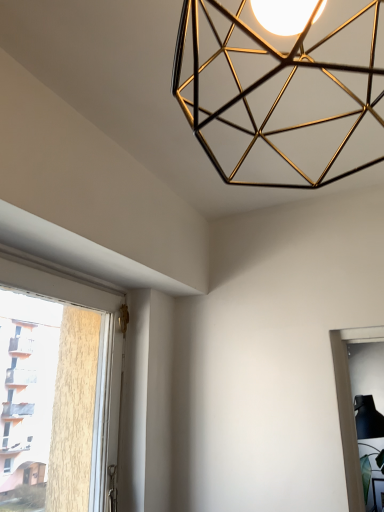
The image size is (384, 512). Identify the location of transparent glass window at lower right, which is the 2th window from front to back. (349, 408).

Image resolution: width=384 pixels, height=512 pixels. Find the location of `gold metallic geometric light fixture at upper center`. gold metallic geometric light fixture at upper center is located at coordinates (266, 81).

From a real-world perspective, which is physically below, white plastic window at left, the 2th window when ordered from bottom to top, or gold metallic geometric light fixture at upper center?

white plastic window at left, the 2th window when ordered from bottom to top.

Consider the image. Is white plastic window at left, placed as the second window when sorted from back to front, thinner than gold metallic geometric light fixture at upper center?

Yes.

Considering the positions of points (13, 269) and (190, 113), is point (13, 269) closer to camera compared to point (190, 113)?

No, it is behind (190, 113).

From the image's perspective, is white plastic window at left, arranged as the 1th window when viewed from the left, over gold metallic geometric light fixture at upper center?

Actually, white plastic window at left, arranged as the 1th window when viewed from the left, appears below gold metallic geometric light fixture at upper center in the image.

Who is smaller, gold metallic geometric light fixture at upper center or transparent glass window at lower right, arranged as the first window when viewed from the back?

gold metallic geometric light fixture at upper center.

Is gold metallic geometric light fixture at upper center to the left or to the right of transparent glass window at lower right, which is counted as the 2th window, starting from the top, in the image?

gold metallic geometric light fixture at upper center is positioned on transparent glass window at lower right, which is counted as the 2th window, starting from the top,'s left side.

Considering the sizes of gold metallic geometric light fixture at upper center and transparent glass window at lower right, which is the 2th window from front to back, in the image, is gold metallic geometric light fixture at upper center wider or thinner than transparent glass window at lower right, which is the 2th window from front to back,?

Clearly, gold metallic geometric light fixture at upper center has less width compared to transparent glass window at lower right, which is the 2th window from front to back.

The height and width of the screenshot is (512, 384). What are the coordinates of `lamp in front of the transparent glass window at lower right, which is the 1th window in right-to-left order` in the screenshot? It's located at (266, 81).

Can you tell me how much transparent glass window at lower right, which is counted as the 2th window, starting from the top, and white plastic window at left, arranged as the 1th window when viewed from the left, differ in facing direction?

The angle between the facing direction of transparent glass window at lower right, which is counted as the 2th window, starting from the top, and the facing direction of white plastic window at left, arranged as the 1th window when viewed from the left, is 39.8 degrees.

Is transparent glass window at lower right, which is the second window in left-to-right order, smaller than white plastic window at left, placed as the second window when sorted from back to front?

No.

Is transparent glass window at lower right, which is the 2th window from front to back, to the right of white plastic window at left, the 2th window when ordered from bottom to top, from the viewer's perspective?

Yes.

Which is more to the right, white plastic window at left, arranged as the 1th window when viewed from the front, or transparent glass window at lower right, which is counted as the 2th window, starting from the top?

transparent glass window at lower right, which is counted as the 2th window, starting from the top.

Is white plastic window at left, placed as the second window when sorted from back to front, in contact with transparent glass window at lower right, which is counted as the 2th window, starting from the top?

No, white plastic window at left, placed as the second window when sorted from back to front, is not in contact with transparent glass window at lower right, which is counted as the 2th window, starting from the top.

You are a GUI agent. You are given a task and a screenshot of the screen. Output one action in this format:
    pyautogui.click(x=<x>, y=<y>)
    Task: Click on the window located above the transparent glass window at lower right, which is counted as the 2th window, starting from the top (from a real-world perspective)
    This screenshot has height=512, width=384.
    Given the screenshot: What is the action you would take?
    pyautogui.click(x=53, y=282)

Does white plastic window at left, the 2th window from the right, lie in front of transparent glass window at lower right, arranged as the first window when viewed from the back?

Yes, white plastic window at left, the 2th window from the right, is closer to the viewer.

You are a GUI agent. You are given a task and a screenshot of the screen. Output one action in this format:
    pyautogui.click(x=<x>, y=<y>)
    Task: Click on the lamp in front of the white plastic window at left, the 2th window from the right
    The image size is (384, 512).
    Given the screenshot: What is the action you would take?
    pyautogui.click(x=266, y=81)

Who is taller, gold metallic geometric light fixture at upper center or white plastic window at left, placed as the second window when sorted from back to front?

Standing taller between the two is white plastic window at left, placed as the second window when sorted from back to front.

Does gold metallic geometric light fixture at upper center have a larger size compared to white plastic window at left, the 2th window when ordered from bottom to top?

No.

Is transparent glass window at lower right, which is the 1th window in right-to-left order, not within gold metallic geometric light fixture at upper center?

Yes, transparent glass window at lower right, which is the 1th window in right-to-left order, is located beyond the bounds of gold metallic geometric light fixture at upper center.

From the picture: What's the angular difference between transparent glass window at lower right, which is the 1th window in right-to-left order, and gold metallic geometric light fixture at upper center's facing directions?

The angle between the facing direction of transparent glass window at lower right, which is the 1th window in right-to-left order, and the facing direction of gold metallic geometric light fixture at upper center is 130 degrees.

From the image's perspective, which is above, transparent glass window at lower right, the 1th window positioned from the bottom, or gold metallic geometric light fixture at upper center?

gold metallic geometric light fixture at upper center.

Does point (347, 357) come in front of point (233, 101)?

No.

The height and width of the screenshot is (512, 384). I want to click on window to the left of gold metallic geometric light fixture at upper center, so click(53, 282).

Where is `the 2nd window directly beneath the gold metallic geometric light fixture at upper center (from a real-world perspective)`? the 2nd window directly beneath the gold metallic geometric light fixture at upper center (from a real-world perspective) is located at coordinates (349, 408).

Estimate the real-world distances between objects in this image. Which object is further from white plastic window at left, the 2th window when ordered from bottom to top, transparent glass window at lower right, arranged as the first window when viewed from the back, or gold metallic geometric light fixture at upper center?

Based on the image, transparent glass window at lower right, arranged as the first window when viewed from the back, appears to be further to white plastic window at left, the 2th window when ordered from bottom to top.

Estimate the real-world distances between objects in this image. Which object is closer to gold metallic geometric light fixture at upper center, transparent glass window at lower right, which is the 1th window in right-to-left order, or white plastic window at left, arranged as the 1th window when viewed from the left?

The object closer to gold metallic geometric light fixture at upper center is white plastic window at left, arranged as the 1th window when viewed from the left.

From the image, which object appears to be nearer to white plastic window at left, the 2th window when ordered from bottom to top, gold metallic geometric light fixture at upper center or transparent glass window at lower right, arranged as the first window when viewed from the back?

Based on the image, gold metallic geometric light fixture at upper center appears to be nearer to white plastic window at left, the 2th window when ordered from bottom to top.

Which object lies nearer to the anchor point gold metallic geometric light fixture at upper center, white plastic window at left, the 2th window from the right, or transparent glass window at lower right, which is the 2th window from front to back?

white plastic window at left, the 2th window from the right, lies closer to gold metallic geometric light fixture at upper center than the other object.

Based on their spatial positions, is gold metallic geometric light fixture at upper center or white plastic window at left, the 2th window from the right, closer to transparent glass window at lower right, which is the 2th window from front to back?

gold metallic geometric light fixture at upper center is closer to transparent glass window at lower right, which is the 2th window from front to back.

Considering their positions, is white plastic window at left, arranged as the 1th window when viewed from the front, positioned closer to transparent glass window at lower right, arranged as the first window when viewed from the back, than gold metallic geometric light fixture at upper center?

gold metallic geometric light fixture at upper center is closer to transparent glass window at lower right, arranged as the first window when viewed from the back.

I want to click on window between gold metallic geometric light fixture at upper center and transparent glass window at lower right, which is the second window in left-to-right order, along the z-axis, so pos(53,282).